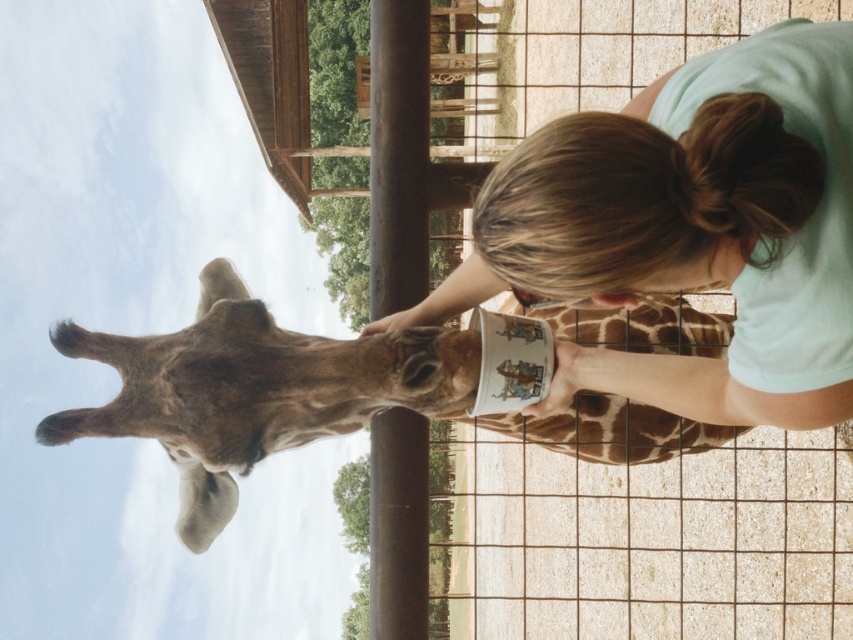
You are standing in front of the giraffe enclosure and want to take a photo. There are two points marked in the image. The first point is at coordinate point [741,72] and the second point is at coordinate point [601,332]. Which point is closer to you?

Point [741,72] is closer to the camera than point [601,332], so the first point is closer to you.

You are standing in front of the giraffe enclosure at the zoo. You want to take a photo of the giraffe and the person feeding it. The camera you have can only focus on objects within 30 feet. Is the point at coordinates point (781,179) within the camera focus range?

The point at point (781,179) is 36.76 feet from the camera, which is beyond the camera focus range of 30 feet. Therefore, the camera cannot focus on this point.